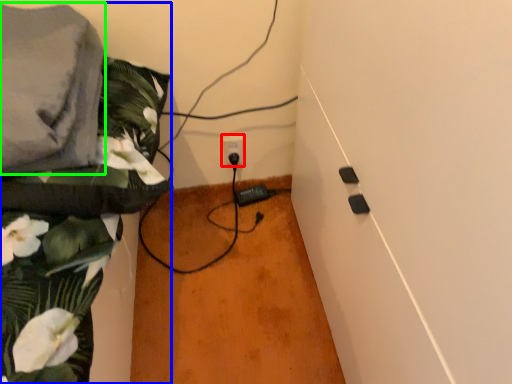
Question: Which object is positioned farthest from power plugs and sockets (highlighted by a red box)? Select from textile (highlighted by a blue box) and linen (highlighted by a green box).

Choices:
 (A) textile
 (B) linen

Answer: (B)